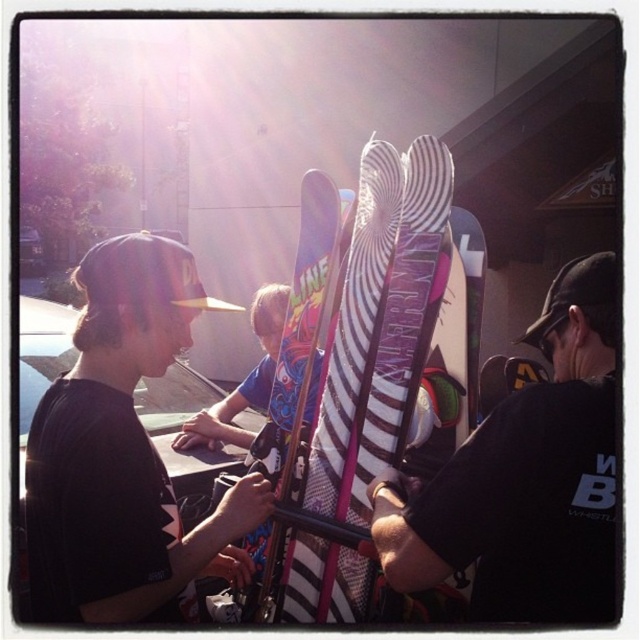
You are trying to place the black matte cap at left on top of the multicolored striped ski at center. Will it fit without hanging over the edges?

The black matte cap at left might be wider than multicolored striped ski at center, so there is a chance it will hang over the edges.